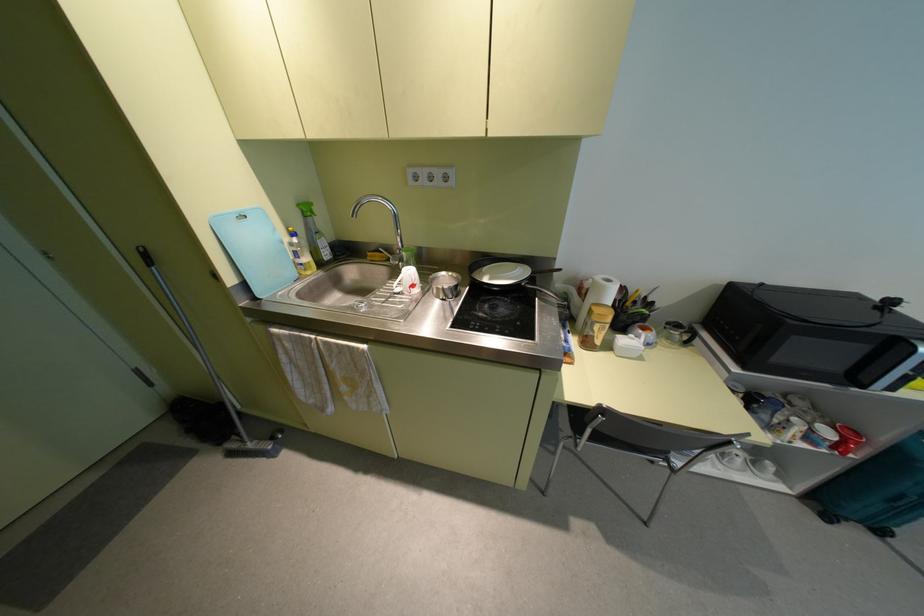
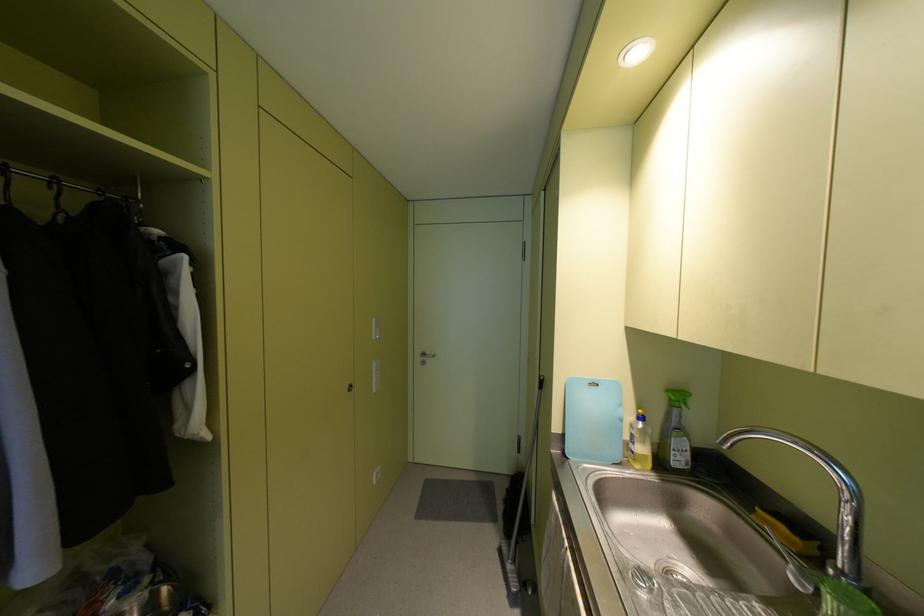
In the second image, find the point that corresponds to point 282,241 in the first image.

(621, 419)